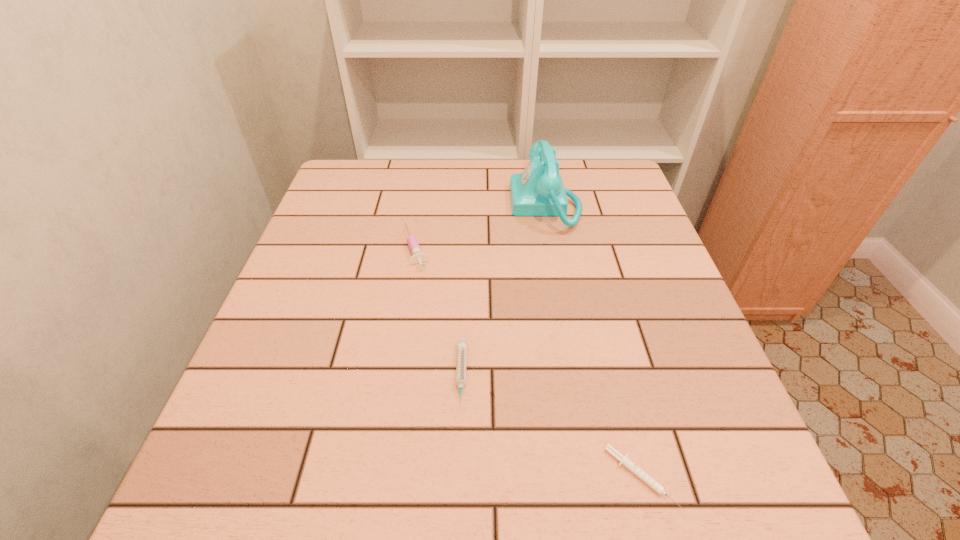
Find the location of a particular element. The image size is (960, 540). vacant region located 0.270m on the front of the farthest syringe is located at coordinates (396, 376).

This screenshot has width=960, height=540. What are the coordinates of `free location located 0.050m at the needle end of the second nearest syringe` in the screenshot? It's located at coord(459,441).

The width and height of the screenshot is (960, 540). I want to click on blank space located on the left of the shortest syringe, so click(421, 477).

Identify the location of object situated at the far edge. (539, 190).

Locate an element on the screen. This screenshot has width=960, height=540. object that is at the near edge is located at coordinates (658, 488).

The image size is (960, 540). I want to click on telephone that is at the right edge, so click(539, 190).

You are a GUI agent. You are given a task and a screenshot of the screen. Output one action in this format:
    pyautogui.click(x=<x>, y=<y>)
    Task: Click on the syringe located at the right edge
    
    Given the screenshot: What is the action you would take?
    pyautogui.click(x=658, y=488)

The image size is (960, 540). I want to click on object that is positioned at the far right corner, so click(x=539, y=190).

Find the location of a particular element. object situated at the near right corner is located at coordinates (658, 488).

At what (x,y) coordinates should I click in order to perform the action: click on vacant point at the far edge. Please return your answer as a coordinate pair (x, y). The width and height of the screenshot is (960, 540). Looking at the image, I should click on (453, 161).